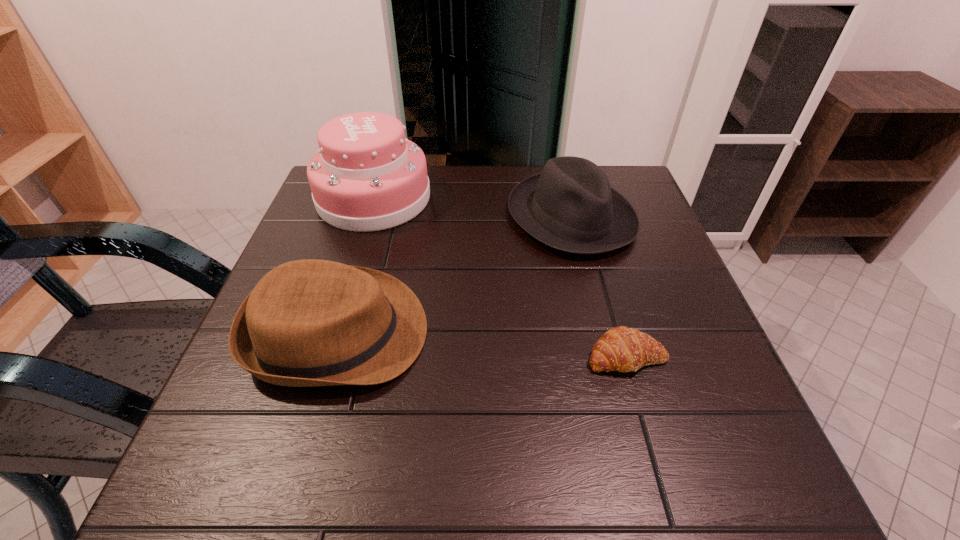
Choose which object is the third nearest neighbor to the shortest object. Please provide its 2D coordinates. Your answer should be formatted as a tuple, i.e. [(x, y)], where the tuple contains the x and y coordinates of a point satisfying the conditions above.

[(366, 176)]

Image resolution: width=960 pixels, height=540 pixels. Identify the location of object that is the third closest one to the nearer fedora. (623, 349).

Locate an element on the screen. vacant space that satisfies the following two spatial constraints: 1. on the front-facing side of the nearer fedora; 2. on the right side of the crescent roll is located at coordinates (331, 356).

Find the location of a particular element. free region that satisfies the following two spatial constraints: 1. on the front side of the farther fedora; 2. on the front-facing side of the nearer fedora is located at coordinates (599, 333).

The height and width of the screenshot is (540, 960). I want to click on free region that satisfies the following two spatial constraints: 1. on the front-facing side of the left fedora; 2. on the left side of the crescent roll, so click(331, 356).

Identify the location of free space that satisfies the following two spatial constraints: 1. on the front-facing side of the shortest object; 2. on the right side of the left fedora. Image resolution: width=960 pixels, height=540 pixels. (331, 356).